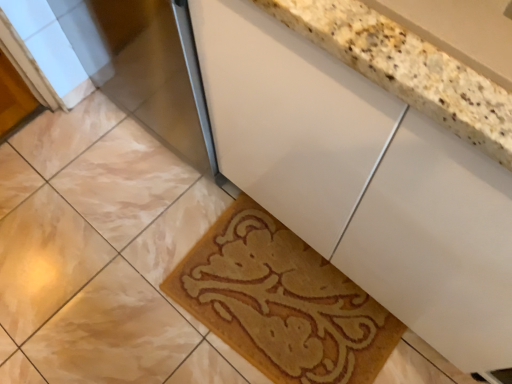
The image size is (512, 384). What do you see at coordinates (44, 260) in the screenshot?
I see `marble tile at lower left` at bounding box center [44, 260].

This screenshot has width=512, height=384. What do you see at coordinates (362, 181) in the screenshot?
I see `white glossy cabinet at center` at bounding box center [362, 181].

Image resolution: width=512 pixels, height=384 pixels. What do you see at coordinates (282, 302) in the screenshot?
I see `beige textured bath mat at lower center` at bounding box center [282, 302].

Image resolution: width=512 pixels, height=384 pixels. I want to click on marble tile at lower left, so click(x=44, y=260).

Is beige textured bath mat at lower center positioned before white glossy cabinet at center?

No, beige textured bath mat at lower center is behind white glossy cabinet at center.

Which of these two, beige textured bath mat at lower center or white glossy cabinet at center, stands shorter?

beige textured bath mat at lower center is shorter.

How much distance is there between beige textured bath mat at lower center and white glossy cabinet at center?

The distance of beige textured bath mat at lower center from white glossy cabinet at center is 16.89 inches.

How different are the orientations of beige textured bath mat at lower center and white glossy cabinet at center in degrees?

The facing directions of beige textured bath mat at lower center and white glossy cabinet at center are 4.33 degrees apart.

Is marble tile at lower left inside the boundaries of white glossy cabinet at center, or outside?

The correct answer is: outside.

Which is farther, (34, 230) or (346, 66)?

The point (34, 230) is more distant.

From the image's perspective, which is below, marble tile at lower left or white glossy cabinet at center?

marble tile at lower left, from the image's perspective.

From a real-world perspective, is beige textured bath mat at lower center physically above marble tile at lower left?

Indeed, from a real-world perspective, beige textured bath mat at lower center stands above marble tile at lower left.

Which point is more forward, [214,241] or [40,254]?

The point [40,254] is more forward.

Identify the location of ceramic tile on the left of beige textured bath mat at lower center. This screenshot has height=384, width=512. (44, 260).

Is white glossy cabinet at center directly adjacent to beige textured bath mat at lower center?

white glossy cabinet at center and beige textured bath mat at lower center are clearly separated.

From the image's perspective, is white glossy cabinet at center located beneath beige textured bath mat at lower center?

No, from the image's perspective, white glossy cabinet at center is not below beige textured bath mat at lower center.

Between white glossy cabinet at center and beige textured bath mat at lower center, which one has larger size?

white glossy cabinet at center is bigger.

Where is `bath mat that appears in front of the marble tile at lower left`? The height and width of the screenshot is (384, 512). bath mat that appears in front of the marble tile at lower left is located at coordinates (282, 302).

Can you confirm if marble tile at lower left is shorter than beige textured bath mat at lower center?

Indeed, marble tile at lower left has a lesser height compared to beige textured bath mat at lower center.

Measure the distance between marble tile at lower left and beige textured bath mat at lower center.

A distance of 17.65 inches exists between marble tile at lower left and beige textured bath mat at lower center.

From the picture: From a real-world perspective, which object stands above the other?

beige textured bath mat at lower center.

Are white glossy cabinet at center and marble tile at lower left beside each other?

No, white glossy cabinet at center is not with marble tile at lower left.

Between point (338, 197) and point (55, 289), which one is positioned in front?

The point (338, 197) is in front.

Is white glossy cabinet at center inside the boundaries of marble tile at lower left, or outside?

The correct answer is: outside.

Is white glossy cabinet at center further to camera compared to marble tile at lower left?

That is False.

The height and width of the screenshot is (384, 512). What are the coordinates of `counter that appears in front of the beige textured bath mat at lower center` in the screenshot? It's located at (362, 181).

Locate an element on the screen. This screenshot has width=512, height=384. counter lying on the right of marble tile at lower left is located at coordinates (362, 181).

From the image, which object appears to be nearer to marble tile at lower left, white glossy cabinet at center or beige textured bath mat at lower center?

The object closer to marble tile at lower left is beige textured bath mat at lower center.

Estimate the real-world distances between objects in this image. Which object is closer to beige textured bath mat at lower center, marble tile at lower left or white glossy cabinet at center?

white glossy cabinet at center is positioned closer to the anchor beige textured bath mat at lower center.

Estimate the real-world distances between objects in this image. Which object is further from white glossy cabinet at center, marble tile at lower left or beige textured bath mat at lower center?

marble tile at lower left.

Based on their spatial positions, is white glossy cabinet at center or marble tile at lower left closer to beige textured bath mat at lower center?

Among the two, white glossy cabinet at center is located nearer to beige textured bath mat at lower center.

Considering their positions, is beige textured bath mat at lower center positioned closer to white glossy cabinet at center than marble tile at lower left?

beige textured bath mat at lower center lies closer to white glossy cabinet at center than the other object.

Based on the photo, estimate the real-world distances between objects in this image. Which object is closer to marble tile at lower left, beige textured bath mat at lower center or white glossy cabinet at center?

The object closer to marble tile at lower left is beige textured bath mat at lower center.

Image resolution: width=512 pixels, height=384 pixels. Identify the location of bath mat located between marble tile at lower left and white glossy cabinet at center in the left-right direction. (282, 302).